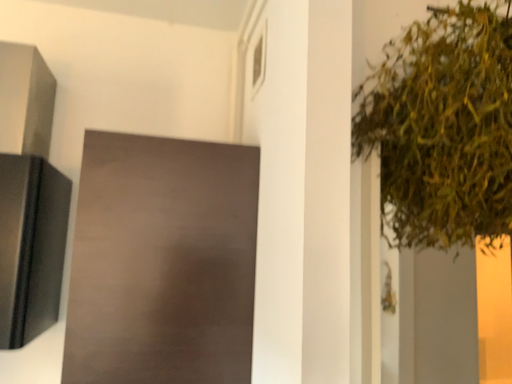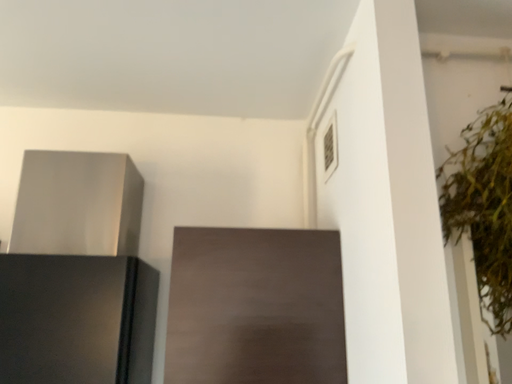
Question: Which way did the camera rotate in the video?

Choices:
 (A) rotated left
 (B) rotated right

Answer: (A)